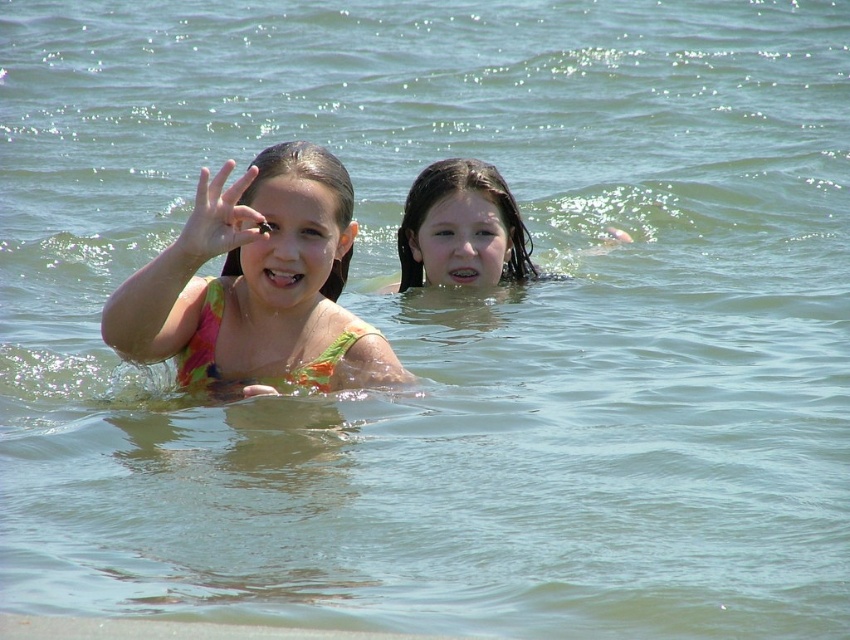
Is multicolored fabric bikini at center smaller than wet hair at center?

Incorrect, multicolored fabric bikini at center is not smaller in size than wet hair at center.

Can you confirm if multicolored fabric bikini at center is positioned to the left of wet hair at center?

Indeed, multicolored fabric bikini at center is positioned on the left side of wet hair at center.

At what (x,y) coordinates should I click in order to perform the action: click on multicolored fabric bikini at center. Please return your answer as a coordinate pair (x, y). Looking at the image, I should click on (256, 284).